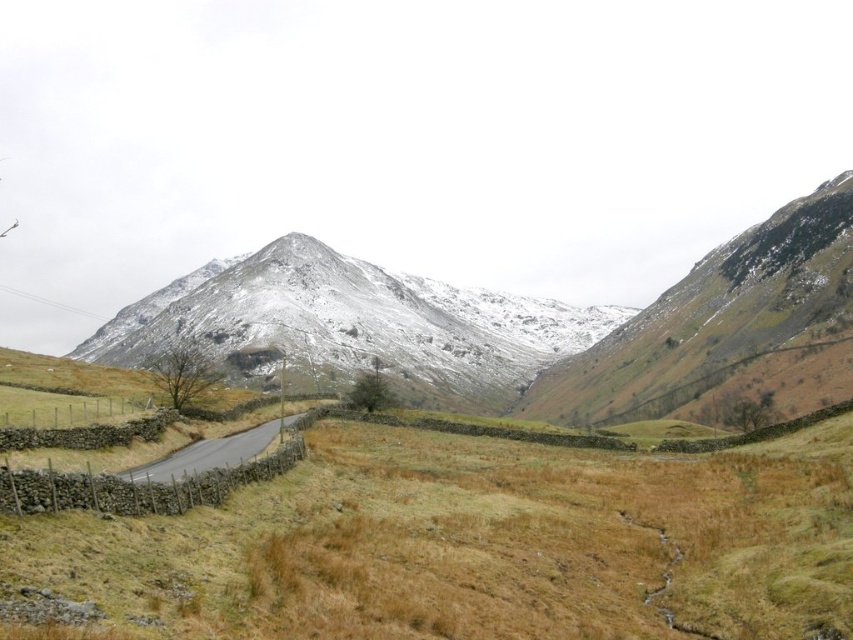
You are driving along the black asphalt road at center and want to reach the snowy rock mountain at center. Can you drive directly to the mountain from the road?

The snowy rock mountain at center is positioned over the black asphalt road at center, meaning the road leads directly to the mountain. Yes, you can drive directly to the mountain from the road.

You are a hiker planning to take a photo of both the snowy rock mountain at center and the black asphalt road at center. Which object should you focus on first if you want to capture both in a single frame without moving your camera?

The snowy rock mountain at center is wider than the black asphalt road at center, so you should focus on the snowy rock mountain at center first to ensure its entire width fits in the frame before adjusting for the narrower road.

You are a hiker planning to take a photo of the snowy rock mountain at center from the black asphalt road at center. Considering their relative heights, which object will appear larger in your camera view?

The snowy rock mountain at center will appear larger in your camera view because it has a greater height compared to the black asphalt road at center.